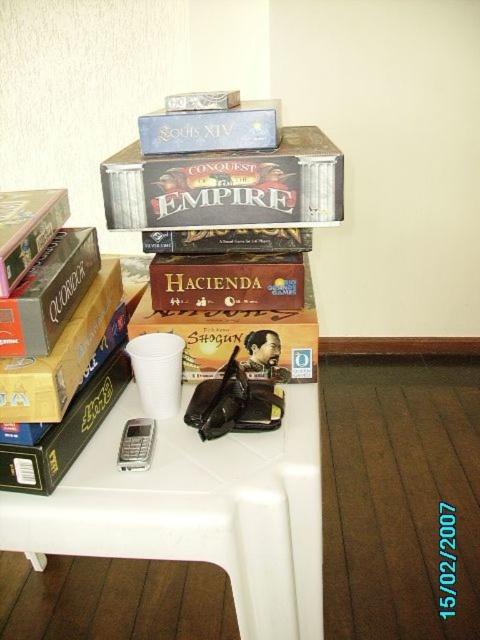
You are organizing a board game night and need to place the matte brown book at left and the blue cardboard box at upper center on a shelf. Which object should you place first if you want to maintain their original left to right arrangement?

You should place the matte brown book at left first on the left side of the shelf, followed by the blue cardboard box at upper center to its right, as the matte brown book at left is positioned to the left of blue cardboard box at upper center in the original arrangement.

You have a small gift that needs to fit into either the matte brown book at left or the blue cardboard box at upper center. Based on their sizes, which one is more likely to accommodate the gift?

The blue cardboard box at upper center has a greater width than the matte brown book at left, so it is more likely to accommodate the gift.